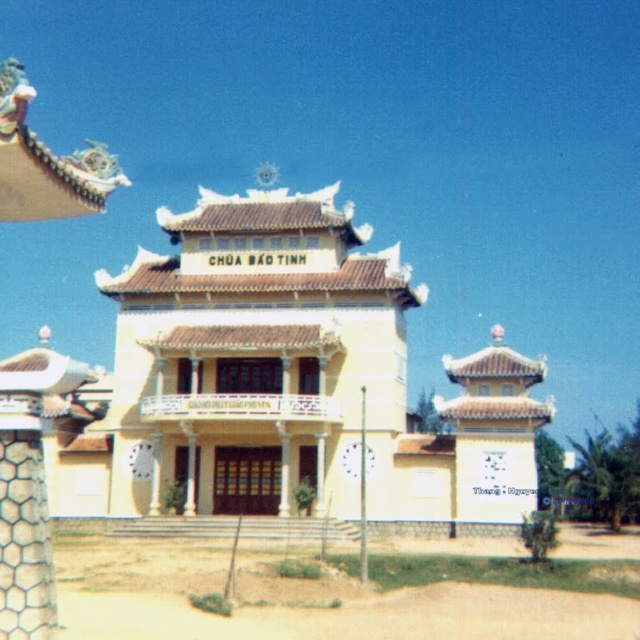
Question: Can you confirm if brown sandy dirt field at lower center is bigger than white hexagonal mesh at lower left?

Choices:
 (A) no
 (B) yes

Answer: (B)

Question: Is yellow matte building at center thinner than brown sandy dirt field at lower center?

Choices:
 (A) yes
 (B) no

Answer: (B)

Question: Which of these objects is positioned farthest from the yellow matte building at center?

Choices:
 (A) brown sandy dirt field at lower center
 (B) white hexagonal mesh at lower left

Answer: (B)

Question: Which object is farther from the camera taking this photo?

Choices:
 (A) yellow matte building at center
 (B) white hexagonal mesh at lower left
 (C) brown sandy dirt field at lower center

Answer: (C)

Question: Is yellow matte building at center to the right of white hexagonal mesh at lower left from the viewer's perspective?

Choices:
 (A) yes
 (B) no

Answer: (B)

Question: Among these points, which one is farthest from the camera?

Choices:
 (A) (16, 480)
 (B) (396, 627)
 (C) (144, 513)

Answer: (C)